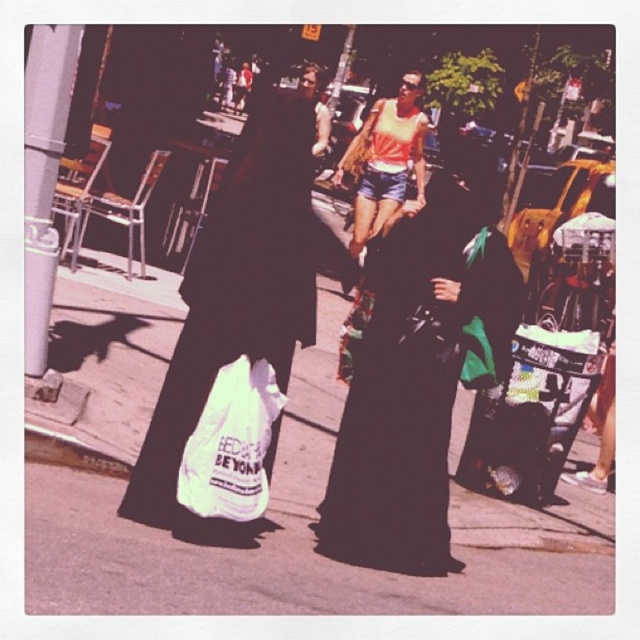
You are a delivery person who needs to hand over a package to a customer. You see two white bags in the scene. The customer mentioned they have a white paper bag at center and a white plastic bag at lower center. Which bag is closer to the left side of the image?

The white paper bag at center is to the left of the white plastic bag at lower center, so the white paper bag at center is closer to the left side of the image.

You are standing at the origin of the coordinate system in this urban street scene. You see two points plotted on the image. Which point is closer to you, the point at coordinates point (468,195) or point (237,406)?

Point (237,406) is closer to you because it is in front of point 0.305, 0.732 according to their positions in the scene.

You are a delivery person who needs to pick up a package from the store. You see two white plastic bags in the scene. Which one is closer to you, the white matte plastic bag at center or the white plastic bag at lower center?

The white matte plastic bag at center is closer to you because it is in front of the white plastic bag at lower center.